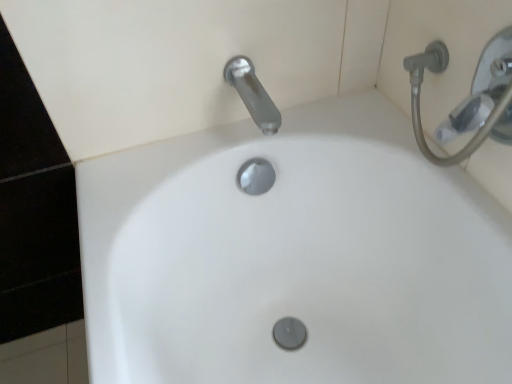
Question: Can you confirm if satin nickel faucet at upper center is positioned to the left of silver metallic shower head at upper right?

Choices:
 (A) yes
 (B) no

Answer: (A)

Question: Does satin nickel faucet at upper center lie in front of silver metallic shower head at upper right?

Choices:
 (A) yes
 (B) no

Answer: (B)

Question: Does satin nickel faucet at upper center have a greater width compared to silver metallic shower head at upper right?

Choices:
 (A) yes
 (B) no

Answer: (A)

Question: Is satin nickel faucet at upper center shorter than silver metallic shower head at upper right?

Choices:
 (A) no
 (B) yes

Answer: (B)

Question: Is satin nickel faucet at upper center beside silver metallic shower head at upper right?

Choices:
 (A) yes
 (B) no

Answer: (B)

Question: Is silver metallic shower head at upper right inside or outside of satin nickel faucet at upper center?

Choices:
 (A) inside
 (B) outside

Answer: (B)

Question: From their relative heights in the image, would you say silver metallic shower head at upper right is taller or shorter than satin nickel faucet at upper center?

Choices:
 (A) short
 (B) tall

Answer: (B)

Question: Relative to satin nickel faucet at upper center, is silver metallic shower head at upper right in front or behind?

Choices:
 (A) behind
 (B) front

Answer: (B)

Question: In terms of width, does silver metallic shower head at upper right look wider or thinner when compared to satin nickel faucet at upper center?

Choices:
 (A) thin
 (B) wide

Answer: (A)

Question: Is satin nickel faucet at upper center bigger or smaller than silver metallic shower head at upper right?

Choices:
 (A) small
 (B) big

Answer: (A)

Question: From a real-world perspective, relative to silver metallic shower head at upper right, is satin nickel faucet at upper center vertically above or below?

Choices:
 (A) below
 (B) above

Answer: (A)

Question: Considering the positions of point (225, 64) and point (494, 84), is point (225, 64) closer or farther from the camera than point (494, 84)?

Choices:
 (A) closer
 (B) farther

Answer: (B)

Question: Is satin nickel faucet at upper center in front of or behind silver metallic shower head at upper right in the image?

Choices:
 (A) front
 (B) behind

Answer: (B)

Question: From their relative heights in the image, would you say white glossy sink at center is taller or shorter than satin nickel faucet at upper center?

Choices:
 (A) tall
 (B) short

Answer: (A)

Question: Is point (236, 266) closer or farther from the camera than point (250, 77)?

Choices:
 (A) closer
 (B) farther

Answer: (B)